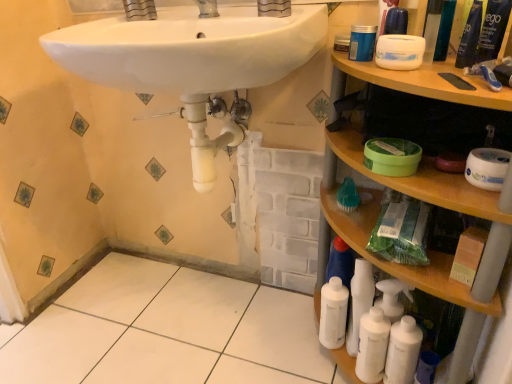
This screenshot has height=384, width=512. In order to click on blank area to the left of white plastic bottle at lower right in this screenshot , I will do `click(273, 349)`.